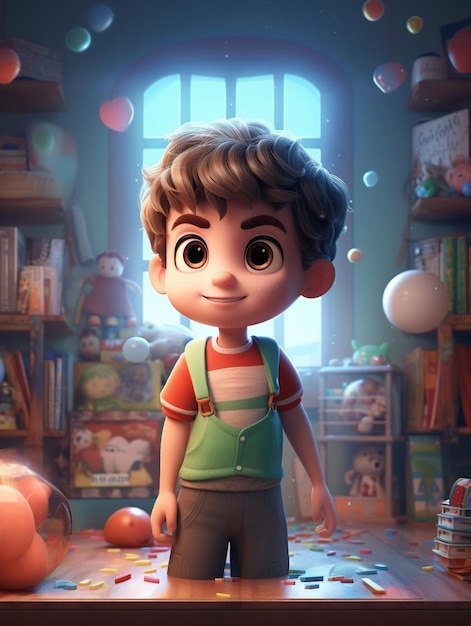
Identify the location of book shelves. (26, 437), (19, 326), (31, 203), (32, 98), (437, 99), (449, 213), (464, 329), (462, 434).